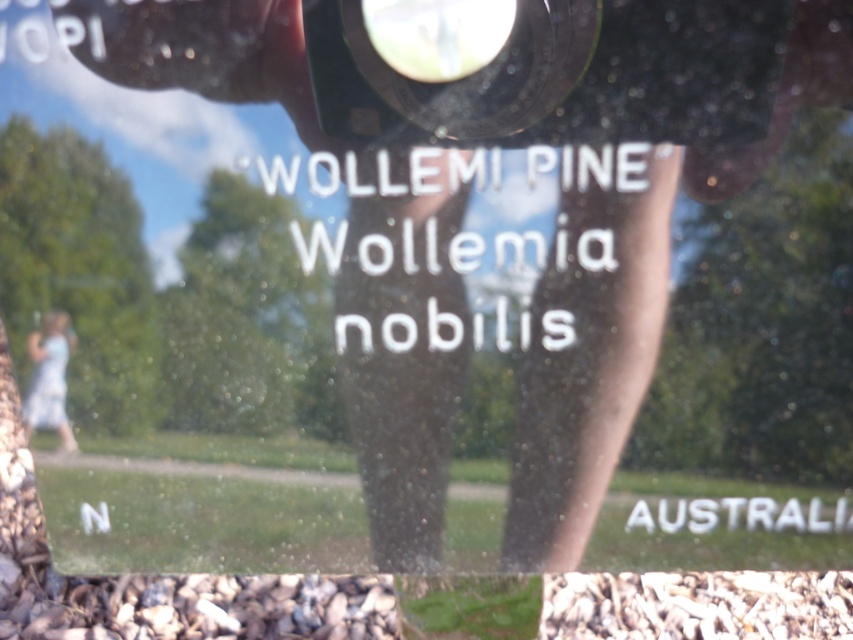
Which of these two, black plastic lens at upper center or light blue fabric dress at lower left, stands shorter?

With less height is black plastic lens at upper center.

Can you confirm if black plastic lens at upper center is taller than light blue fabric dress at lower left?

Incorrect, black plastic lens at upper center's height is not larger of light blue fabric dress at lower left's.

Does point (376, 122) lie in front of point (33, 348)?

Yes, it is.

Locate an element on the screen. Image resolution: width=853 pixels, height=640 pixels. black plastic lens at upper center is located at coordinates (447, 80).